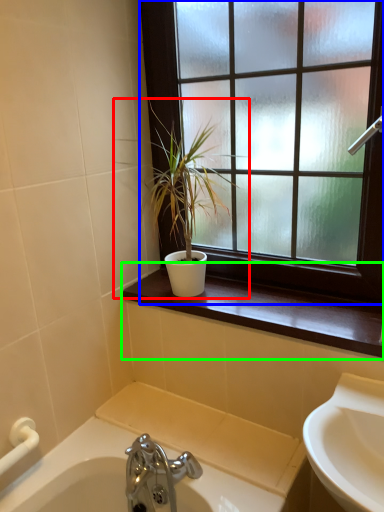
Question: Which is farther away from houseplant (highlighted by a red box)? window (highlighted by a blue box) or window sill (highlighted by a green box)?

Choices:
 (A) window
 (B) window sill

Answer: (B)